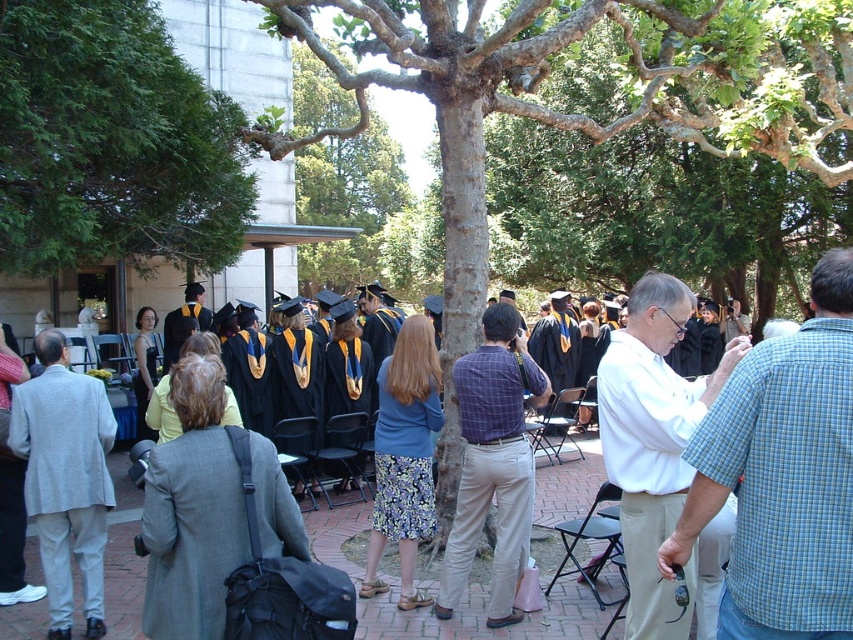
Question: Which is nearer to the graduation gown at center?

Choices:
 (A) light gray wool suit at left
 (B) green leafy tree at upper left

Answer: (B)

Question: Considering the real-world distances, which object is closest to the blue floral skirt at center?

Choices:
 (A) green textured tree at center
 (B) white shirt at center
 (C) matte black graduation gown at center
 (D) black satin gown at center

Answer: (B)

Question: Among these points, which one is nearest to the camera?

Choices:
 (A) pyautogui.click(x=753, y=480)
 (B) pyautogui.click(x=482, y=432)
 (C) pyautogui.click(x=384, y=500)
 (D) pyautogui.click(x=173, y=256)

Answer: (A)

Question: Does white shirt at center have a lesser width compared to graduation gown at center?

Choices:
 (A) yes
 (B) no

Answer: (A)

Question: From the image, what is the correct spatial relationship of white shirt at center in relation to black satin gown at center?

Choices:
 (A) left
 (B) right

Answer: (B)

Question: Can you confirm if matte black graduation gown at center is thinner than black satin gown at center?

Choices:
 (A) yes
 (B) no

Answer: (A)